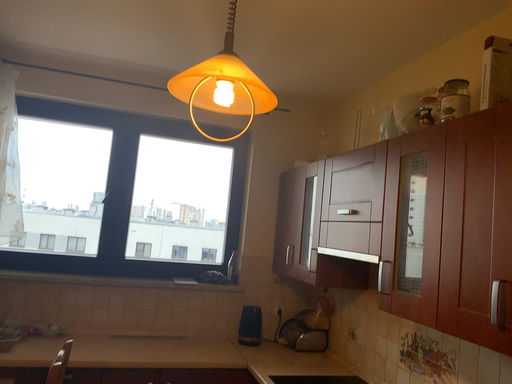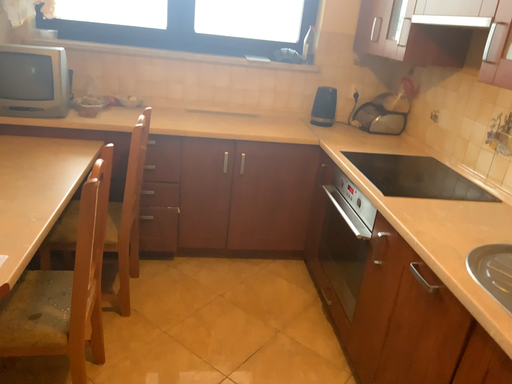
Question: Which way did the camera rotate in the video?

Choices:
 (A) rotated left
 (B) rotated right

Answer: (A)